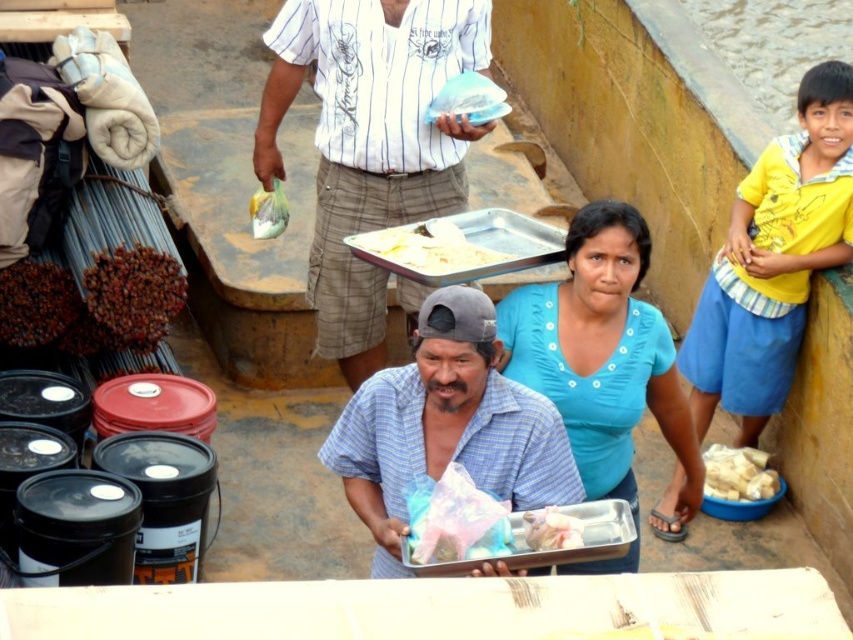
You are a photographer trying to capture both the blue cotton shirt at center and the white plastic bag at upper center in a single frame. Given their positions, which object should you focus on first to ensure both are in the frame?

The blue cotton shirt at center is taller than the white plastic bag at upper center, so you should focus on the blue cotton shirt at center first to ensure both are in the frame.